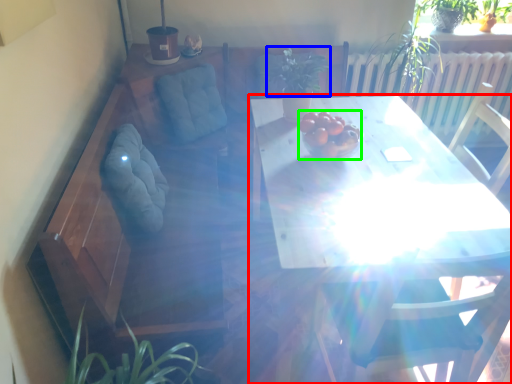
Question: Which is nearer to the table (highlighted by a red box)? plant (highlighted by a blue box) or fruit (highlighted by a green box).

Choices:
 (A) plant
 (B) fruit

Answer: (B)